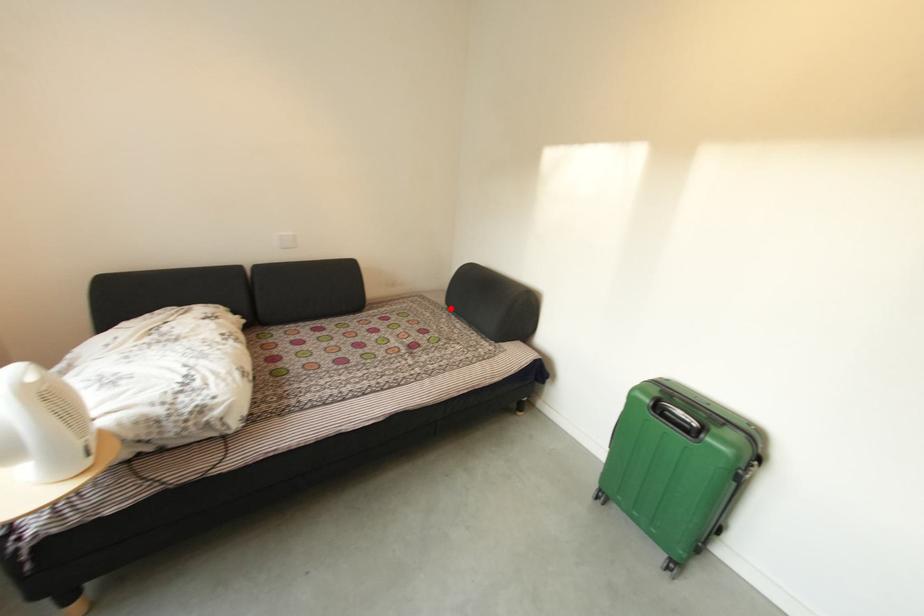
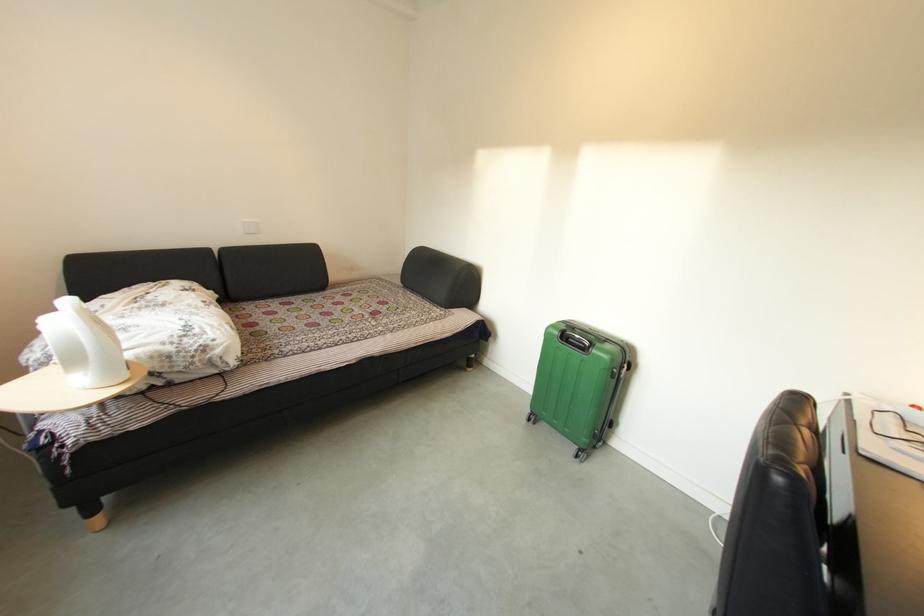
Find the pixel in the second image that matches the highlighted location in the first image.

(407, 286)